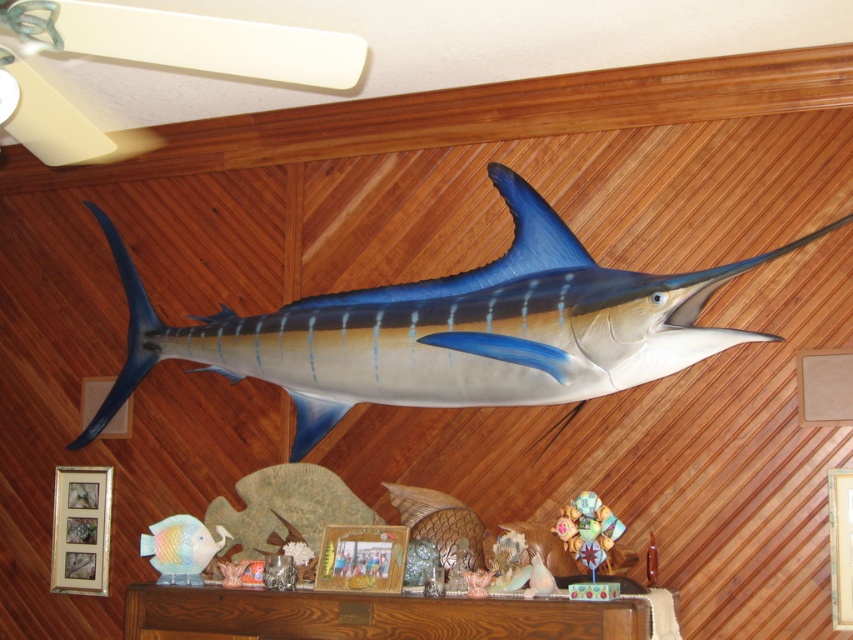
You are an interior designer arranging items on a mantelpiece. You have a shiny blue fish at center and a pastel ceramic fish at lower left. Which fish is located to the right of the other?

The shiny blue fish at center is positioned on the right side of pastel ceramic fish at lower left.

You are standing in front of the mounted marlin fish and want to determine the relative positions of two points on the wall. The first point is at coordinates point (x=454, y=284), and the second point is at point (x=199, y=570). Which point is closer to you?

Point (x=199, y=570) is closer to you because it is less further away than point (x=454, y=284).